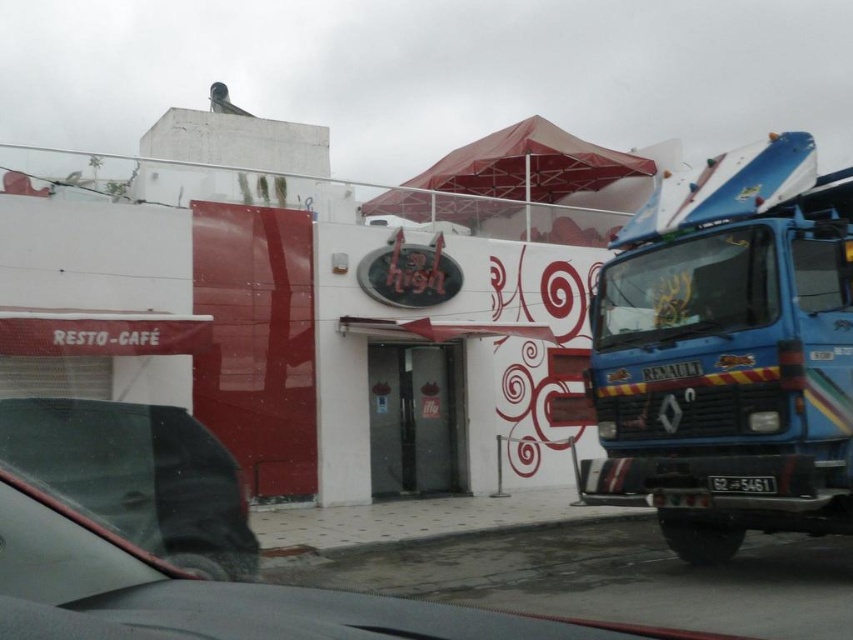
From the picture: Can you confirm if matte black car at lower left is smaller than black plastic license plate at center?

Actually, matte black car at lower left might be larger than black plastic license plate at center.

Measure the distance between matte black car at lower left and camera.

matte black car at lower left and camera are 5.36 meters apart from each other.

What do you see at coordinates (183, 545) in the screenshot? Image resolution: width=853 pixels, height=640 pixels. I see `matte black car at lower left` at bounding box center [183, 545].

I want to click on matte black car at lower left, so click(x=183, y=545).

Can you confirm if blue metallic truck at right is shorter than black plastic license plate at center?

In fact, blue metallic truck at right may be taller than black plastic license plate at center.

Is blue metallic truck at right above black plastic license plate at center?

Yes.

Does point (677, 316) come behind point (711, 481)?

Yes, it is behind point (711, 481).

Locate an element on the screen. The width and height of the screenshot is (853, 640). blue metallic truck at right is located at coordinates (729, 349).

Consider the image. Who is higher up, blue metallic truck at right or matte black car at lower left?

blue metallic truck at right is above.

This screenshot has width=853, height=640. What do you see at coordinates (729, 349) in the screenshot?
I see `blue metallic truck at right` at bounding box center [729, 349].

Where is `blue metallic truck at right`? The width and height of the screenshot is (853, 640). blue metallic truck at right is located at coordinates (x=729, y=349).